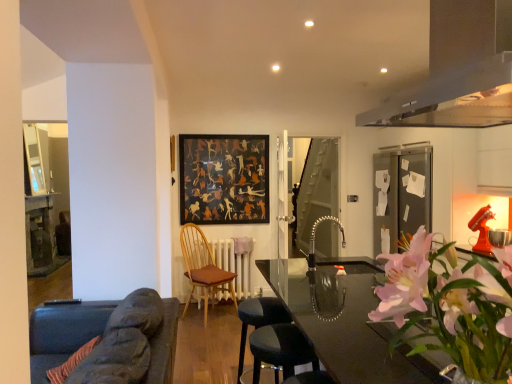
The width and height of the screenshot is (512, 384). What do you see at coordinates (348, 322) in the screenshot?
I see `transparent glass table at center, which ranks as the second table in back-to-front order` at bounding box center [348, 322].

In order to face white painted radiator at center, should I rotate leftwards or rightwards?

To align with it, rotate left about 3.533°.

What do you see at coordinates (236, 262) in the screenshot? Image resolution: width=512 pixels, height=384 pixels. I see `white painted radiator at center` at bounding box center [236, 262].

I want to click on wooden chair with brown cushion at center, so click(203, 268).

Describe the element at coordinates (41, 236) in the screenshot. This screenshot has height=384, width=512. I see `wooden table at left, which is the first table in back-to-front order` at that location.

Image resolution: width=512 pixels, height=384 pixels. What are the coordinates of `transparent glass table at center, marked as the first table in a right-to-left arrangement` in the screenshot? It's located at point(348,322).

From a real-world perspective, between dark gray fabric bar stool at center, which is the second bar stool in front-to-back order, and dark gray fabric bar stool at lower center, arranged as the 1th bar stool when viewed from the front, who is vertically lower?

dark gray fabric bar stool at center, which is the second bar stool in front-to-back order, is physically lower.

In the scene shown: Is dark gray fabric bar stool at center, positioned as the 1th bar stool in back-to-front order, turned away from dark gray fabric bar stool at lower center, acting as the second bar stool starting from the back?

No, dark gray fabric bar stool at lower center, acting as the second bar stool starting from the back, is not at the back of dark gray fabric bar stool at center, positioned as the 1th bar stool in back-to-front order.

Which is in front, point (245, 311) or point (262, 336)?

The point (262, 336) is closer.

In the image, is dark gray fabric bar stool at center, which is the second bar stool in front-to-back order, on the left side or the right side of dark gray fabric bar stool at lower center, acting as the second bar stool starting from the back?

Clearly, dark gray fabric bar stool at center, which is the second bar stool in front-to-back order, is on the left of dark gray fabric bar stool at lower center, acting as the second bar stool starting from the back, in the image.

From a real-world perspective, is white painted radiator at center physically above wooden chair with brown cushion at center?

No, from a real-world perspective, white painted radiator at center is not above wooden chair with brown cushion at center.

Which object is thinner, white painted radiator at center or wooden chair with brown cushion at center?

With smaller width is white painted radiator at center.

Where is `radiator on the right of the wooden chair with brown cushion at center`? radiator on the right of the wooden chair with brown cushion at center is located at coordinates 236,262.

From the image's perspective, is white painted radiator at center on top of wooden chair with brown cushion at center?

No.

Who is bigger, black matte picture frame at center or pink floral arrangement at right?

pink floral arrangement at right is bigger.

From the image's perspective, between black matte picture frame at center and pink floral arrangement at right, which one is located above?

From the image's view, black matte picture frame at center is above.

In the image, is black matte picture frame at center positioned in front of or behind pink floral arrangement at right?

Visually, black matte picture frame at center is located behind pink floral arrangement at right.

Considering the sizes of objects black matte picture frame at center and pink floral arrangement at right in the image provided, who is wider, black matte picture frame at center or pink floral arrangement at right?

Wider between the two is pink floral arrangement at right.

At what (x,y) coordinates should I click in order to perform the action: click on picture frame behind the satin black exhaust hood at upper right. Please return your answer as a coordinate pair (x, y). The image size is (512, 384). Looking at the image, I should click on (224, 179).

Is satin black exhaust hood at upper right thinner than black matte picture frame at center?

No, satin black exhaust hood at upper right is not thinner than black matte picture frame at center.

Is satin black exhaust hood at upper right to the right of black matte picture frame at center from the viewer's perspective?

Indeed, satin black exhaust hood at upper right is positioned on the right side of black matte picture frame at center.

Considering the sizes of objects satin black exhaust hood at upper right and black matte picture frame at center in the image provided, who is taller, satin black exhaust hood at upper right or black matte picture frame at center?

Standing taller between the two is black matte picture frame at center.

Is wooden chair with brown cushion at center wider or thinner than dark gray fabric bar stool at lower center, arranged as the 1th bar stool when viewed from the front?

In the image, wooden chair with brown cushion at center appears to be wider than dark gray fabric bar stool at lower center, arranged as the 1th bar stool when viewed from the front.

In the scene shown: From the image's perspective, relative to dark gray fabric bar stool at lower center, arranged as the 1th bar stool when viewed from the front, is wooden chair with brown cushion at center above or below?

From the image's perspective, wooden chair with brown cushion at center appears above dark gray fabric bar stool at lower center, arranged as the 1th bar stool when viewed from the front.

Is wooden chair with brown cushion at center located outside dark gray fabric bar stool at lower center, acting as the second bar stool starting from the back?

Yes.

Which point is more forward, (x=242, y=278) or (x=442, y=97)?

The point (x=442, y=97) is more forward.

Considering the relative positions of white painted radiator at center and satin black exhaust hood at upper right in the image provided, is white painted radiator at center to the left or to the right of satin black exhaust hood at upper right?

white painted radiator at center is to the left of satin black exhaust hood at upper right.

Is white painted radiator at center closer to camera compared to satin black exhaust hood at upper right?

No, white painted radiator at center is further to the viewer.

Is white painted radiator at center aimed at satin black exhaust hood at upper right?

Yes, white painted radiator at center faces towards satin black exhaust hood at upper right.

What's the angular difference between black matte picture frame at center and transparent glass table at center, acting as the 1th table starting from the front,'s facing directions?

91 degrees.

Does black matte picture frame at center appear on the left side of transparent glass table at center, the 2th table viewed from the left?

Yes.

This screenshot has width=512, height=384. I want to click on the 2nd table below the black matte picture frame at center (from the image's perspective), so click(348, 322).

Which of these two, black matte picture frame at center or transparent glass table at center, marked as the first table in a right-to-left arrangement, stands shorter?

transparent glass table at center, marked as the first table in a right-to-left arrangement.

Find the location of a particular element. bar stool on the right of dark gray fabric bar stool at center, positioned as the 1th bar stool in back-to-front order is located at coordinates (280, 349).

Image resolution: width=512 pixels, height=384 pixels. I want to click on chair that appears on the left of white painted radiator at center, so click(x=203, y=268).

Looking at the image, which one is located closer to transparent glass table at center, marked as the first table in a right-to-left arrangement, wooden chair with brown cushion at center or dark gray fabric bar stool at center, positioned as the 1th bar stool in back-to-front order?

dark gray fabric bar stool at center, positioned as the 1th bar stool in back-to-front order.

Which object lies nearer to the anchor point black matte picture frame at center, wooden chair with brown cushion at center or dark gray fabric bar stool at lower center, acting as the second bar stool starting from the back?

wooden chair with brown cushion at center is closer to black matte picture frame at center.

Looking at the image, which one is located further to satin black exhaust hood at upper right, white painted radiator at center or black matte picture frame at center?

black matte picture frame at center is positioned further to the anchor satin black exhaust hood at upper right.

Considering their positions, is wooden table at left, acting as the 2th table starting from the right, positioned closer to black matte picture frame at center than transparent glass door at center?

Based on the image, transparent glass door at center appears to be nearer to black matte picture frame at center.

Consider the image. Looking at the image, which one is located closer to pink floral arrangement at right, dark gray fabric bar stool at lower center, arranged as the 1th bar stool when viewed from the front, or wooden table at left, the first table positioned from the left?

dark gray fabric bar stool at lower center, arranged as the 1th bar stool when viewed from the front, is positioned closer to the anchor pink floral arrangement at right.

Considering their positions, is wooden table at left, acting as the 2th table starting from the right, positioned further to white painted radiator at center than dark gray fabric bar stool at lower center, arranged as the 1th bar stool when viewed from the front?

The object further to white painted radiator at center is wooden table at left, acting as the 2th table starting from the right.

From the image, which object appears to be nearer to pink floral arrangement at right, satin black exhaust hood at upper right or dark gray fabric bar stool at center, which is the second bar stool in front-to-back order?

satin black exhaust hood at upper right.

Considering their positions, is wooden chair with brown cushion at center positioned closer to pink floral arrangement at right than black matte picture frame at center?

wooden chair with brown cushion at center is positioned closer to the anchor pink floral arrangement at right.

I want to click on bar stool between dark gray fabric bar stool at lower center, acting as the second bar stool starting from the back, and white painted radiator at center in the front-back direction, so click(258, 320).

Find the location of a particular element. This screenshot has width=512, height=384. bar stool between satin black exhaust hood at upper right and transparent glass table at center, which ranks as the second table in back-to-front order, from top to bottom is located at coordinates (280, 349).

In order to click on chair between wooden table at left, the first table positioned from the left, and transparent glass door at center from left to right in this screenshot , I will do `click(203, 268)`.

Identify the location of radiator located between black matte picture frame at center and transparent glass door at center in the left-right direction. The image size is (512, 384). (236, 262).